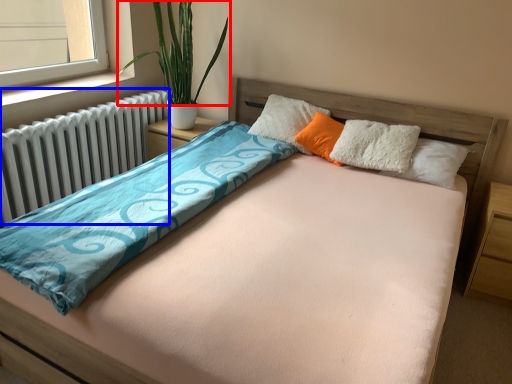
Question: Among these objects, which one is nearest to the camera, plant (highlighted by a red box) or radiator (highlighted by a blue box)?

Choices:
 (A) plant
 (B) radiator

Answer: (B)